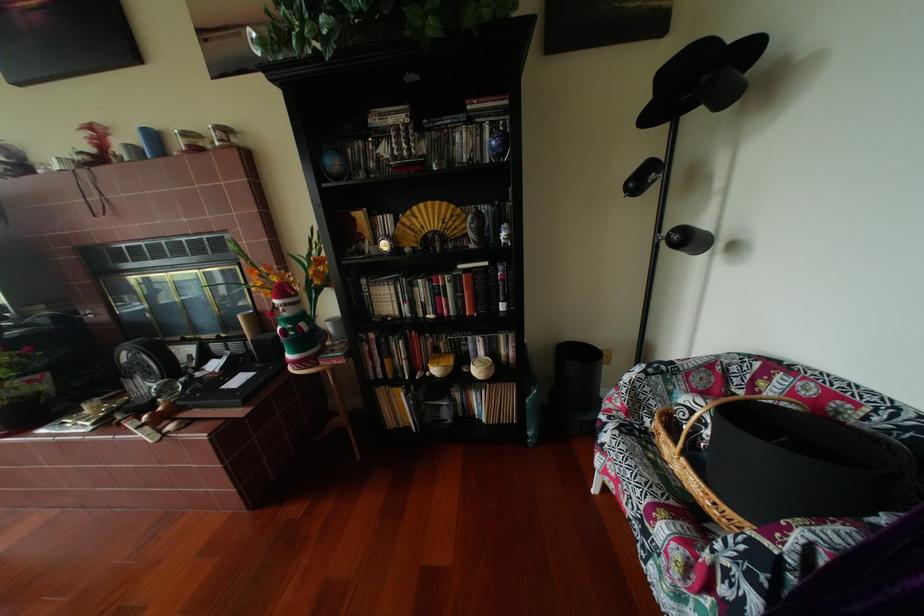
Where is `yellow folding fan`? yellow folding fan is located at coordinates (429, 223).